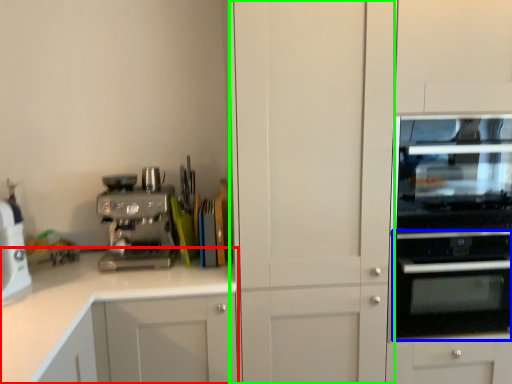
Question: Based on their relative distances, which object is nearer to cabinetry (highlighted by a red box)? Choose from oven (highlighted by a blue box) and glass door (highlighted by a green box).

Choices:
 (A) oven
 (B) glass door

Answer: (B)